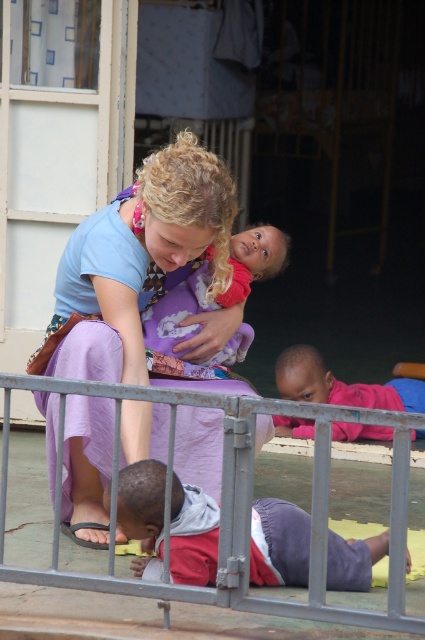
Looking at this image, is metallic gray gate at lower center in front of reddish-purple fabric pants at lower center?

Yes.

Is metallic gray gate at lower center wider than reddish-purple fabric pants at lower center?

Yes.

What do you see at coordinates (175, 586) in the screenshot? Image resolution: width=425 pixels, height=640 pixels. I see `metallic gray gate at lower center` at bounding box center [175, 586].

This screenshot has width=425, height=640. Identify the location of metallic gray gate at lower center. (175, 586).

Between light purple fabric at center and soft purple cloth at center, which one is positioned lower?

Result: Positioned lower is light purple fabric at center.

Between light purple fabric at center and soft purple cloth at center, which one is positioned higher?

Positioned higher is soft purple cloth at center.

This screenshot has width=425, height=640. What do you see at coordinates (136, 260) in the screenshot?
I see `light purple fabric at center` at bounding box center [136, 260].

This screenshot has height=640, width=425. In order to click on light purple fabric at center in this screenshot , I will do `click(136, 260)`.

Looking at this image, does metallic gray gate at lower center come in front of soft purple cloth at center?

Yes.

Measure the distance between metallic gray gate at lower center and soft purple cloth at center.

5.75 feet

Is point (30, 506) farther from viewer compared to point (206, 269)?

Yes.

Identify the location of metallic gray gate at lower center. The width and height of the screenshot is (425, 640). (175, 586).